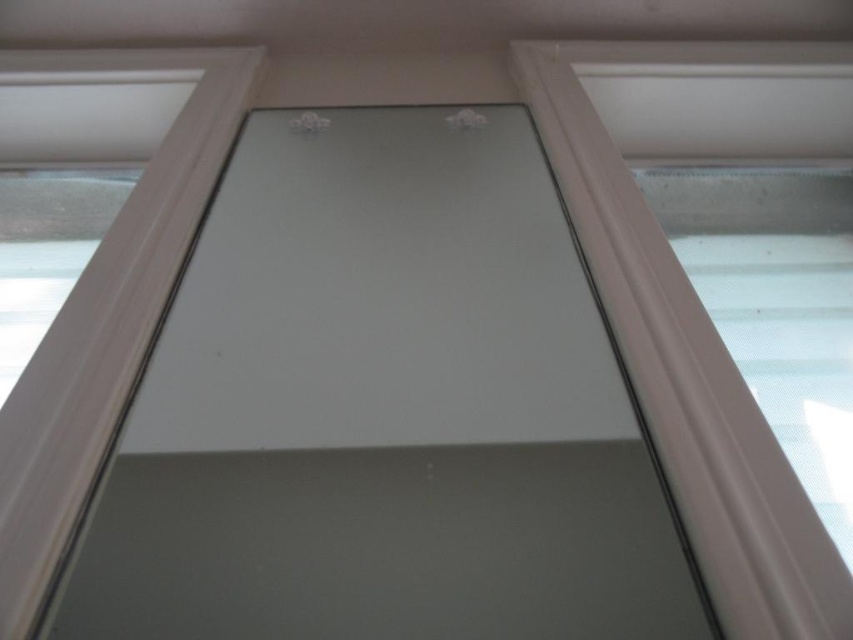
Question: Does white plastic window frame at right appear on the right side of white plastic window frame at upper left?

Choices:
 (A) no
 (B) yes

Answer: (B)

Question: In this image, where is white plastic window frame at right located relative to white plastic window frame at upper left?

Choices:
 (A) below
 (B) above

Answer: (A)

Question: Observing the image, what is the correct spatial positioning of white plastic window frame at right in reference to white plastic window frame at upper left?

Choices:
 (A) left
 (B) right

Answer: (B)